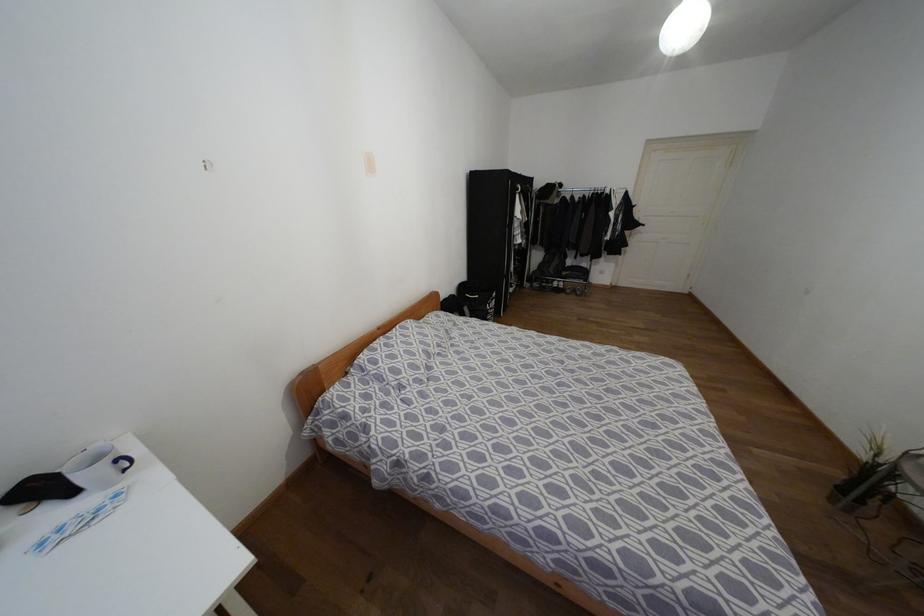
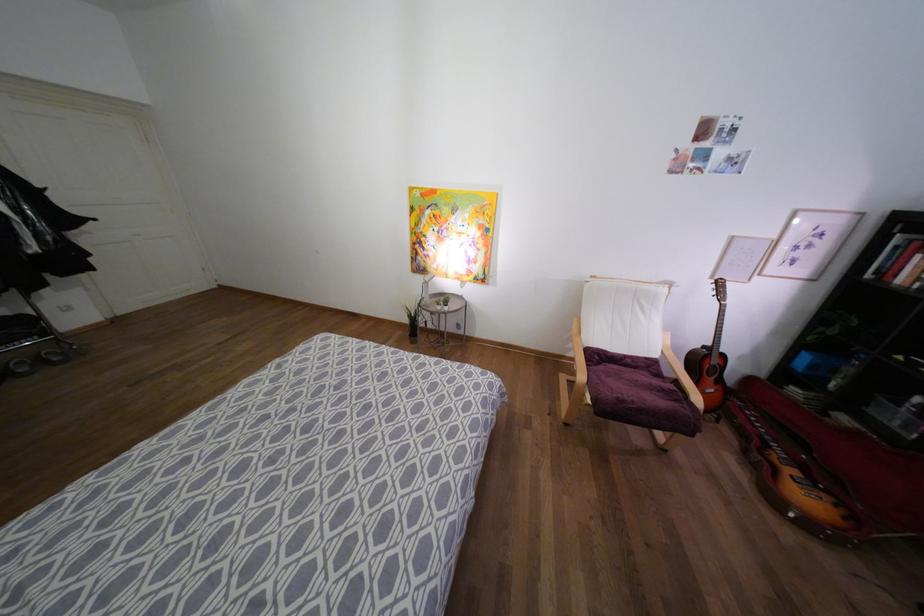
How did the camera likely rotate?

The camera rotated toward right-down.